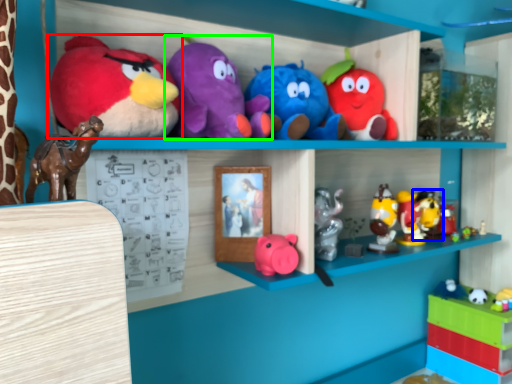
Question: Considering the real-world distances, which object is closest to toy (highlighted by a red box)? toy (highlighted by a blue box) or toy (highlighted by a green box).

Choices:
 (A) toy
 (B) toy

Answer: (B)